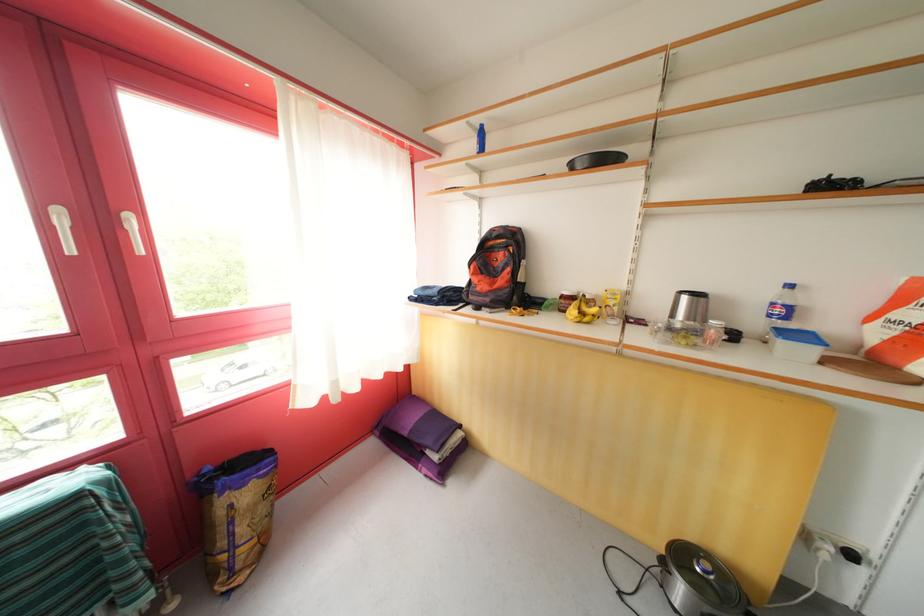
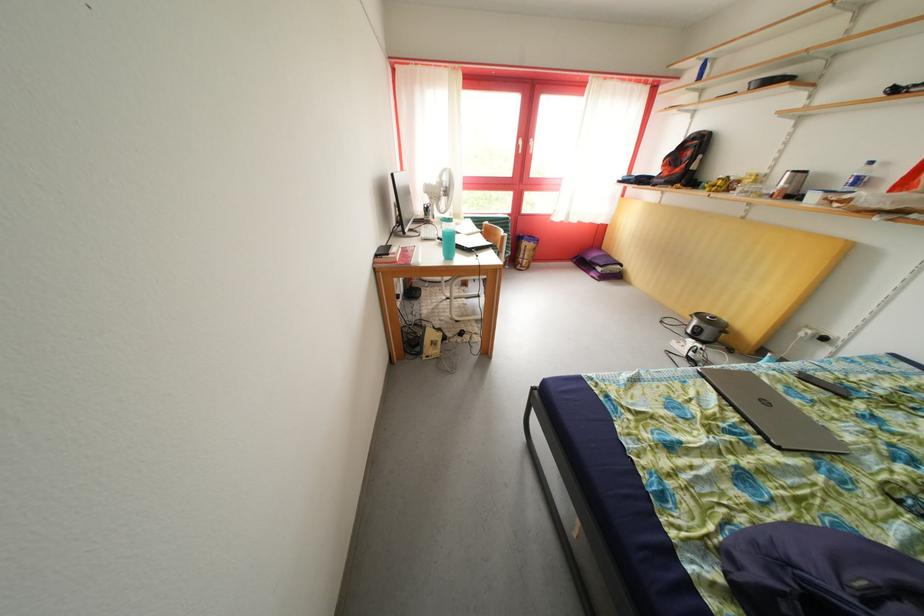
In the second image, find the point that corresponds to (442,463) in the first image.

(608, 275)